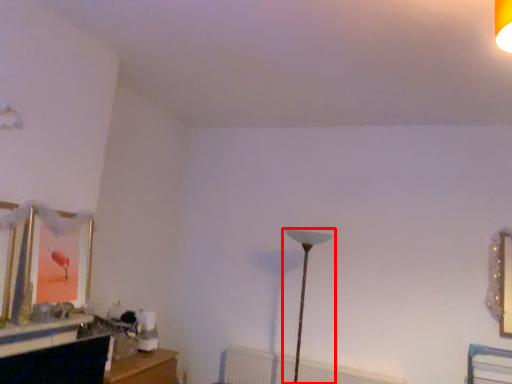
Question: Considering the relative positions of lamp (annotated by the red box) and radiator in the image provided, where is lamp (annotated by the red box) located with respect to the staircase?

Choices:
 (A) left
 (B) right

Answer: (A)